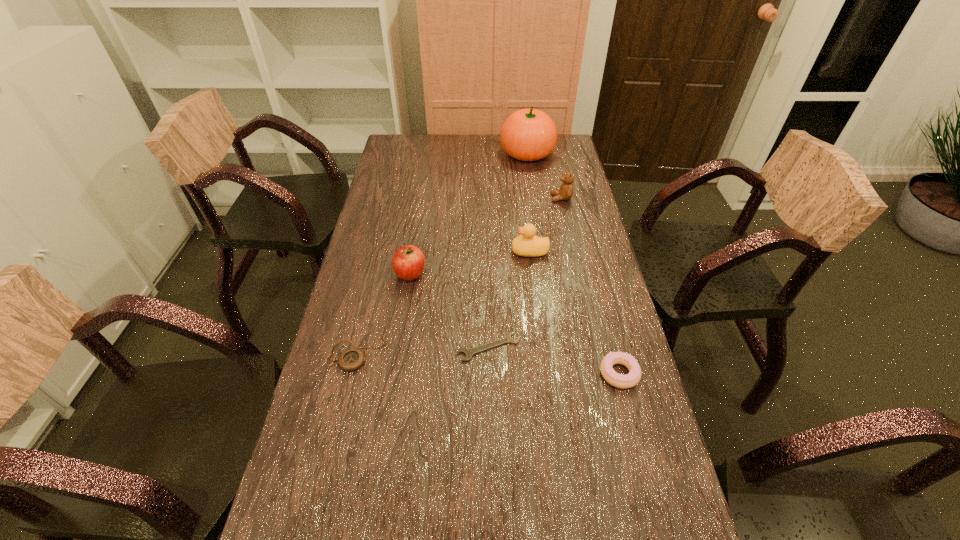
This screenshot has height=540, width=960. What are the coordinates of `free spot between the sixth tallest object and the third shortest object` in the screenshot? It's located at (488, 363).

At what (x,y) coordinates should I click in order to perform the action: click on empty location between the pumpkin and the teddy bear. Please return your answer as a coordinate pair (x, y). This screenshot has width=960, height=540. Looking at the image, I should click on (544, 176).

The image size is (960, 540). Identify the location of free space that is in between the apple and the sixth tallest object. (383, 313).

The image size is (960, 540). What are the coordinates of `vacant region between the fifth tallest object and the farthest object` in the screenshot? It's located at (573, 263).

This screenshot has width=960, height=540. In order to click on empty location between the second shortest object and the farthest object in this screenshot , I will do `click(442, 253)`.

The image size is (960, 540). I want to click on free spot between the second farthest object and the farthest object, so click(x=544, y=176).

Where is `vacant space in between the apple and the tallest object`? This screenshot has width=960, height=540. vacant space in between the apple and the tallest object is located at coordinates pos(468,213).

The width and height of the screenshot is (960, 540). I want to click on free spot between the shortest object and the second shortest object, so click(x=422, y=350).

The image size is (960, 540). What are the coordinates of `vacant region between the third shortest object and the tallest object` in the screenshot? It's located at (573, 263).

Where is `unoccupied position between the pocket watch and the doughnut`? Image resolution: width=960 pixels, height=540 pixels. unoccupied position between the pocket watch and the doughnut is located at coordinates (488, 363).